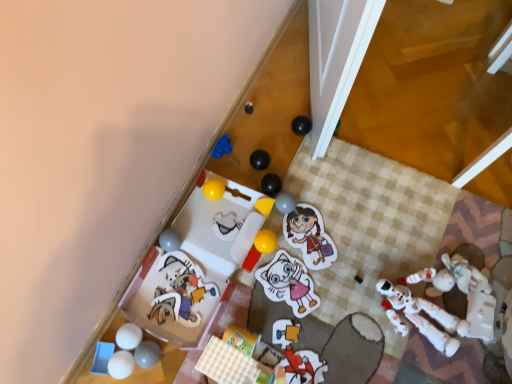
The height and width of the screenshot is (384, 512). I want to click on unoccupied area in front of rubber matte ball at center, marked as the third toy in a right-to-left arrangement, so click(283, 259).